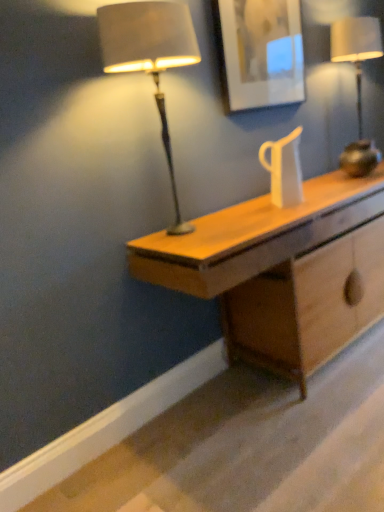
In order to click on vacant area on top of light wood desk at center (from a real-world perspective) in this screenshot , I will do `click(276, 208)`.